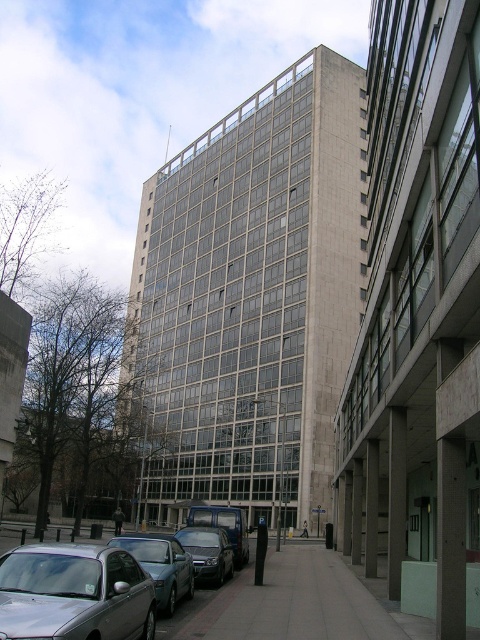
Question: Does silver metallic car at lower left appear under gray concrete pavement at lower center?

Choices:
 (A) yes
 (B) no

Answer: (B)

Question: Among these points, which one is nearest to the camera?

Choices:
 (A) (132, 554)
 (B) (48, 557)
 (C) (240, 548)

Answer: (B)

Question: Which of the following is the closest to the observer?

Choices:
 (A) pos(222,573)
 (B) pos(233,531)
 (C) pos(156,566)
 (D) pos(41,605)

Answer: (D)

Question: Can you confirm if gray concrete pavement at lower center is thinner than metallic blue sedan at center?

Choices:
 (A) no
 (B) yes

Answer: (B)

Question: Is gray concrete pavement at lower center positioned at the back of shiny black sedan at center?

Choices:
 (A) yes
 (B) no

Answer: (B)

Question: Based on their relative distances, which object is nearer to the metallic blue sedan at center?

Choices:
 (A) shiny black sedan at center
 (B) gray concrete pavement at lower center
 (C) silver metallic car at lower left
 (D) metallic silver car at lower left

Answer: (A)